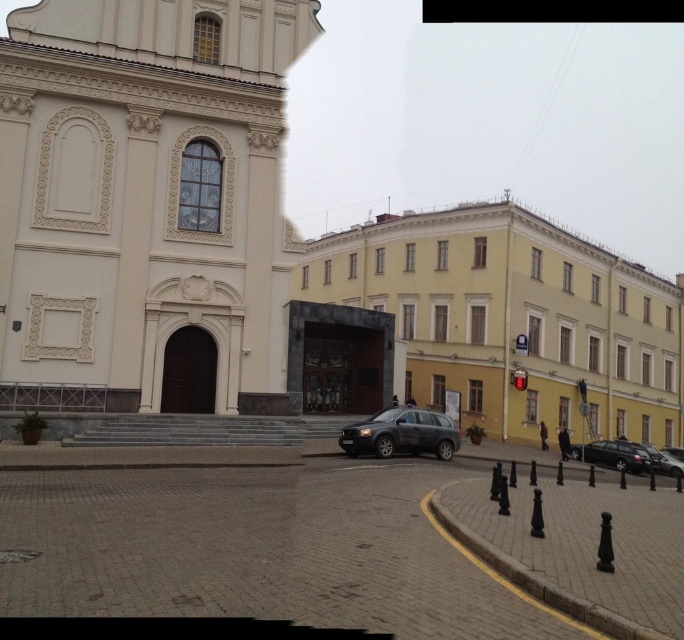
Question: Is white stone church at upper left positioned before yellow matte building at center?

Choices:
 (A) no
 (B) yes

Answer: (B)

Question: Does beige stone church at center have a lesser width compared to white stone church at upper left?

Choices:
 (A) yes
 (B) no

Answer: (B)

Question: Does beige stone church at center come behind white stone church at upper left?

Choices:
 (A) yes
 (B) no

Answer: (A)

Question: Which of the following is the farthest from the observer?

Choices:
 (A) shiny black sedan at lower right
 (B) white stone church at upper left
 (C) yellow matte building at center

Answer: (A)

Question: Among these objects, which one is farthest from the camera?

Choices:
 (A) dark gray matte suv at center
 (B) yellow matte building at center

Answer: (B)

Question: Which of these objects is positioned closest to the yellow matte building at center?

Choices:
 (A) shiny black sedan at lower right
 (B) beige stone church at center
 (C) dark gray matte suv at center
 (D) white stone church at upper left

Answer: (B)